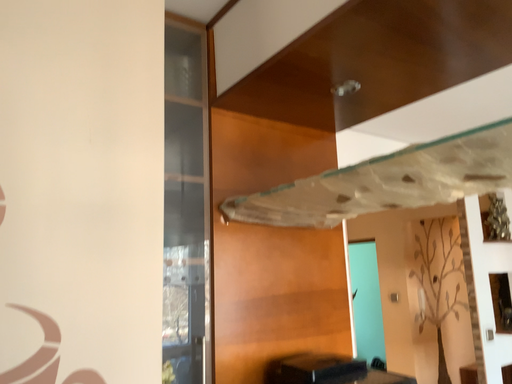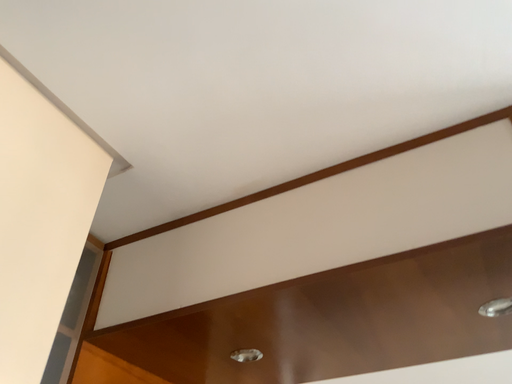
Question: How did the camera likely rotate when shooting the video?

Choices:
 (A) rotated downward
 (B) rotated upward

Answer: (B)